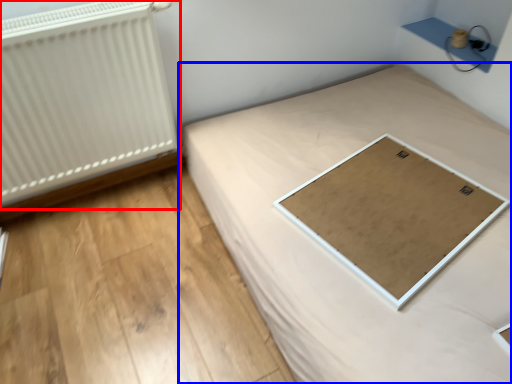
Question: Which object is further to the camera taking this photo, radiator (highlighted by a red box) or bed (highlighted by a blue box)?

Choices:
 (A) radiator
 (B) bed

Answer: (A)